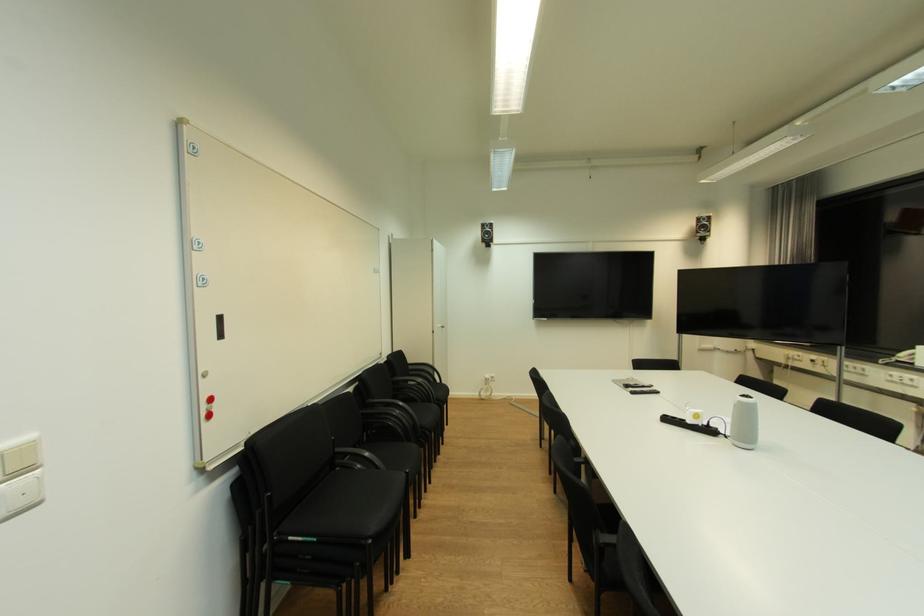
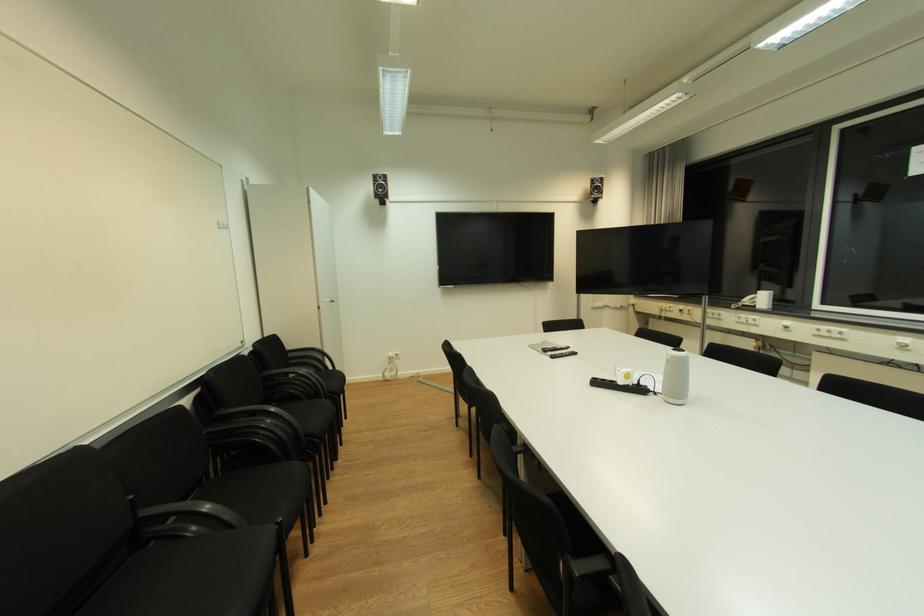
Where in the second image is the point corresponding to [492,377] from the first image?

(396, 355)